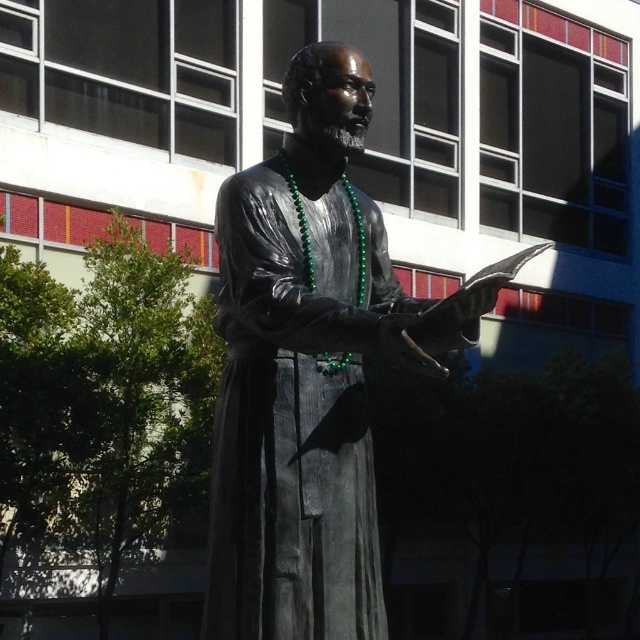
Question: Among these points, which one is nearest to the camera?

Choices:
 (A) (435, 326)
 (B) (342, 401)

Answer: (A)

Question: Does bronze statue at center appear on the left side of bronze textured robe at center?

Choices:
 (A) no
 (B) yes

Answer: (A)

Question: Which of the following is the farthest from the observer?

Choices:
 (A) bronze statue at center
 (B) bronze textured robe at center

Answer: (B)

Question: Does bronze statue at center appear on the left side of bronze textured robe at center?

Choices:
 (A) no
 (B) yes

Answer: (A)

Question: From the image, what is the correct spatial relationship of bronze statue at center in relation to bronze textured robe at center?

Choices:
 (A) right
 (B) left

Answer: (A)